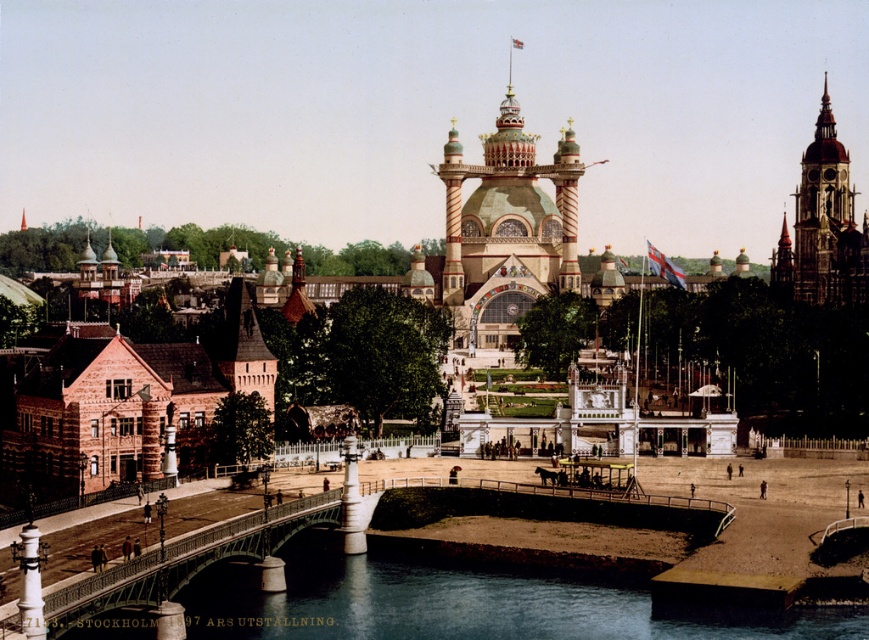
You are an architect examining this historical image of the Stockholm Exhibition of 1897. You notice two points marked in the scene. Which of the two points, point (x=614, y=609) or point (x=816, y=216), is nearer to your viewpoint as you look at the image?

Point (x=614, y=609) is closer to the camera than point (x=816, y=216).